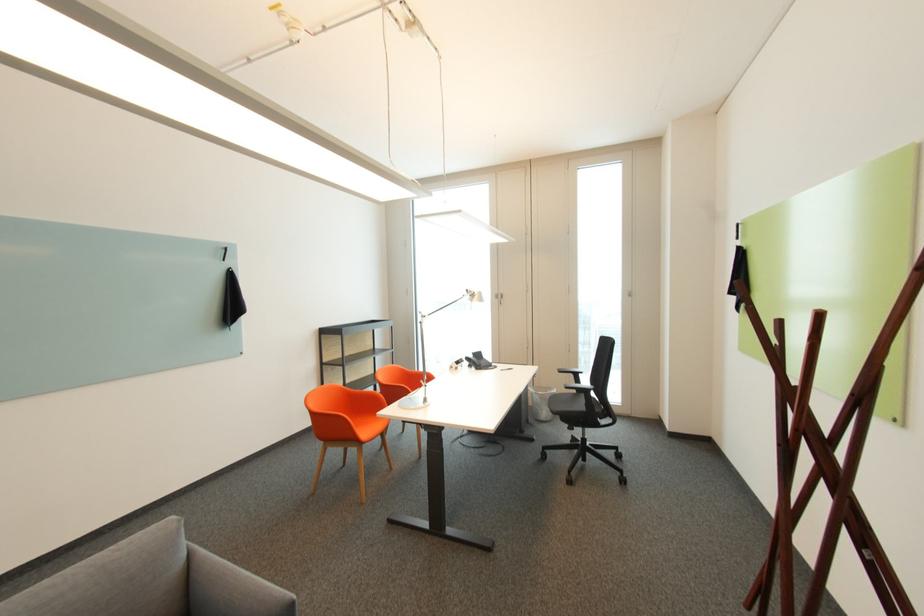
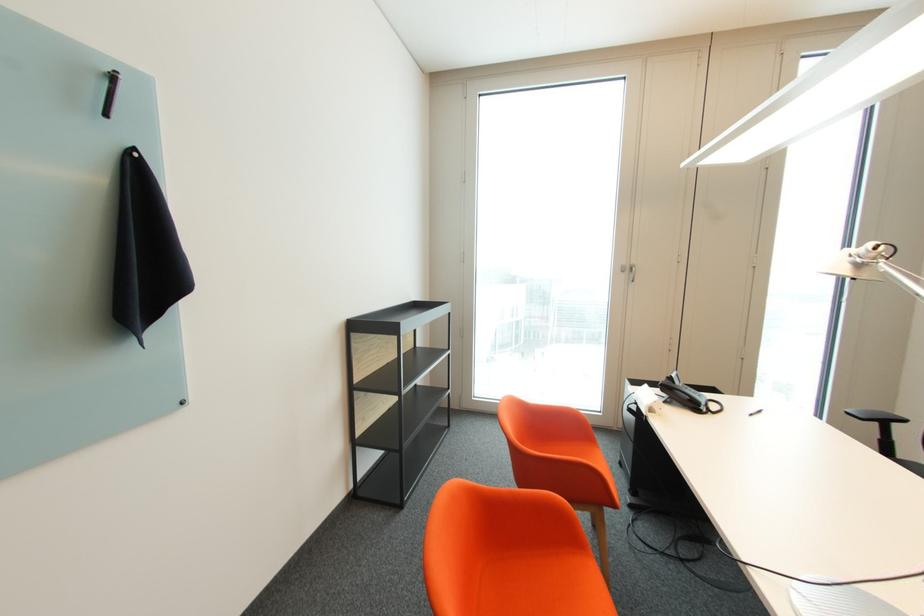
In the second image, find the point that corresponds to pixel 475 363 in the first image.

(673, 397)